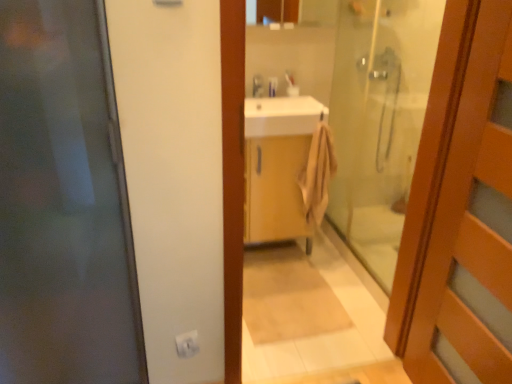
Question: Does matte silver faucet at upper center turn towards transparent glass door at left, the 1th door when ordered from left to right?

Choices:
 (A) no
 (B) yes

Answer: (A)

Question: From a real-world perspective, is matte silver faucet at upper center positioned over transparent glass door at left, the second door in the right-to-left sequence, based on gravity?

Choices:
 (A) yes
 (B) no

Answer: (A)

Question: Considering the relative sizes of matte silver faucet at upper center and transparent glass door at left, the second door in the right-to-left sequence, in the image provided, is matte silver faucet at upper center shorter than transparent glass door at left, the second door in the right-to-left sequence,?

Choices:
 (A) no
 (B) yes

Answer: (B)

Question: Is transparent glass door at left, the second door in the right-to-left sequence, located within matte silver faucet at upper center?

Choices:
 (A) no
 (B) yes

Answer: (A)

Question: From a real-world perspective, is matte silver faucet at upper center under transparent glass door at left, the second door in the right-to-left sequence?

Choices:
 (A) no
 (B) yes

Answer: (A)

Question: Relative to matte silver faucet at upper center, is white plastic electric outlet at lower center in front or behind?

Choices:
 (A) front
 (B) behind

Answer: (A)

Question: Looking at their shapes, would you say white plastic electric outlet at lower center is wider or thinner than matte silver faucet at upper center?

Choices:
 (A) thin
 (B) wide

Answer: (A)

Question: From a real-world perspective, is white plastic electric outlet at lower center physically located above or below matte silver faucet at upper center?

Choices:
 (A) above
 (B) below

Answer: (B)

Question: Would you say white plastic electric outlet at lower center is to the left or to the right of matte silver faucet at upper center in the picture?

Choices:
 (A) right
 (B) left

Answer: (B)

Question: Is white glossy sink at center taller or shorter than wooden cabinet at center?

Choices:
 (A) tall
 (B) short

Answer: (B)

Question: From the image's perspective, is white glossy sink at center above or below wooden cabinet at center?

Choices:
 (A) above
 (B) below

Answer: (A)

Question: Considering the relative positions of white glossy sink at center and wooden cabinet at center in the image provided, is white glossy sink at center to the left or to the right of wooden cabinet at center?

Choices:
 (A) right
 (B) left

Answer: (B)

Question: Looking at their shapes, would you say white glossy sink at center is wider or thinner than wooden cabinet at center?

Choices:
 (A) wide
 (B) thin

Answer: (A)

Question: In the image, is transparent glass door at left, the second door in the right-to-left sequence, positioned in front of or behind wooden cabinet at center?

Choices:
 (A) front
 (B) behind

Answer: (A)

Question: Is transparent glass door at left, the 1th door when ordered from left to right, inside the boundaries of wooden cabinet at center, or outside?

Choices:
 (A) inside
 (B) outside

Answer: (B)